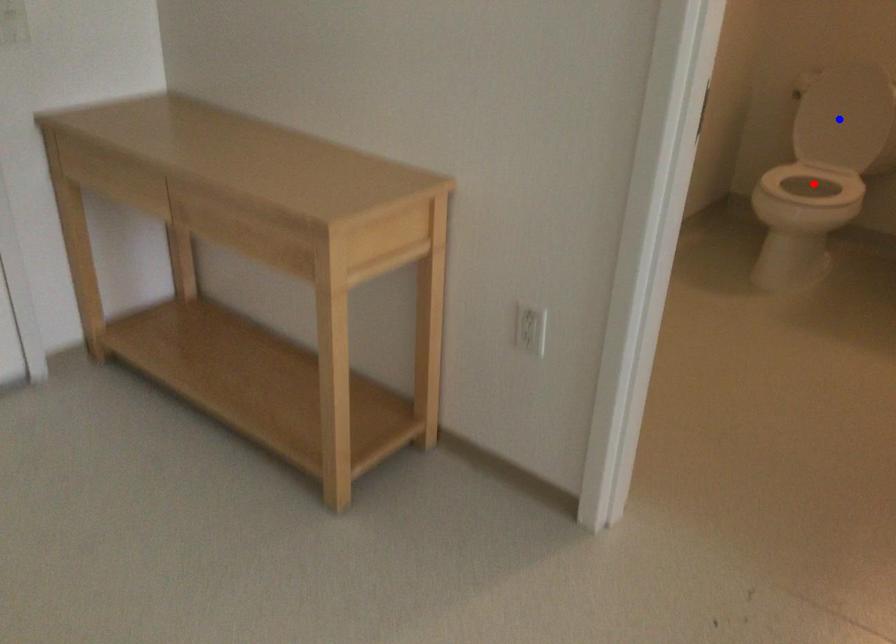
Question: Two points are marked on the image. Which point is closer to the camera?

Choices:
 (A) Blue point is closer.
 (B) Red point is closer.

Answer: (B)